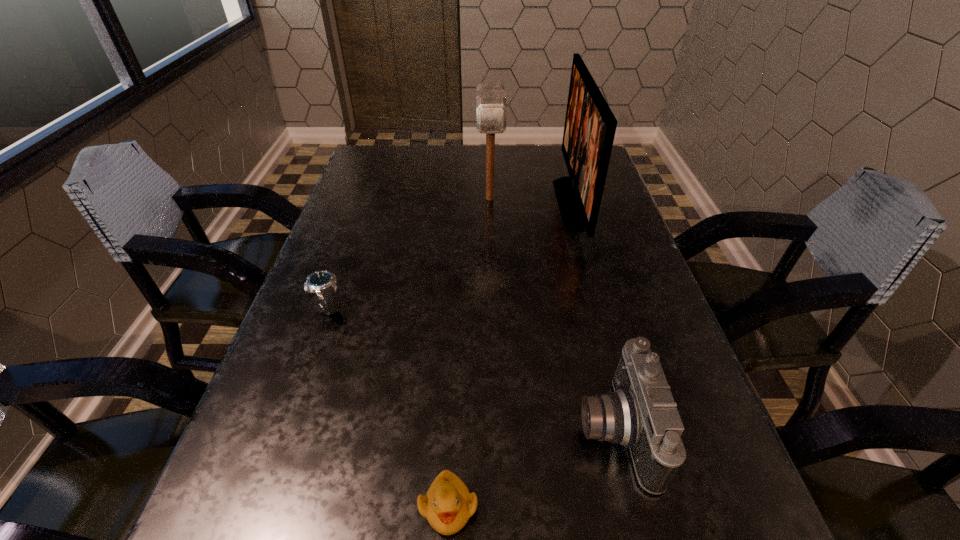
Where is `monitor`? The height and width of the screenshot is (540, 960). monitor is located at coordinates (590, 126).

Locate an element on the screen. This screenshot has width=960, height=540. mallet is located at coordinates (491, 109).

Where is `camera`? The width and height of the screenshot is (960, 540). camera is located at coordinates (641, 414).

At what (x,y) coordinates should I click in order to perform the action: click on the fourth tallest object. Please return your answer as a coordinate pair (x, y). Image resolution: width=960 pixels, height=540 pixels. Looking at the image, I should click on (323, 283).

Find the location of a particular element. watch is located at coordinates (323, 283).

Locate an element on the screen. The image size is (960, 540). the shortest object is located at coordinates (448, 504).

Where is `vacant space located on the front-facing side of the monitor`? This screenshot has width=960, height=540. vacant space located on the front-facing side of the monitor is located at coordinates (456, 202).

This screenshot has height=540, width=960. I want to click on free space located 0.110m on the front-facing side of the monitor, so click(x=517, y=202).

Locate an element on the screen. blank space located 0.350m on the front-facing side of the monitor is located at coordinates (430, 202).

Find the location of a particular element. vacant region located on the striking face of the mallet is located at coordinates (492, 254).